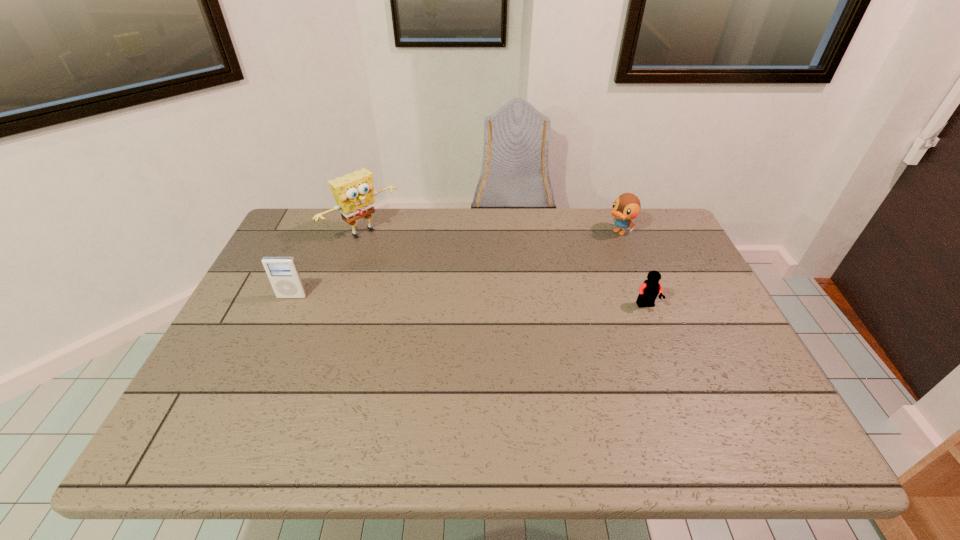
Find the location of a particular element. blank space located on the front-facing side of the duck is located at coordinates (591, 252).

Identify the location of vacant space located 0.130m on the front-facing side of the duck. Image resolution: width=960 pixels, height=540 pixels. (585, 256).

Image resolution: width=960 pixels, height=540 pixels. What are the coordinates of `free point located on the front-facing side of the duck` in the screenshot? It's located at (574, 264).

Find the location of `sponge situated at the far edge`. sponge situated at the far edge is located at coordinates (354, 193).

The width and height of the screenshot is (960, 540). I want to click on duck that is at the far edge, so click(x=626, y=207).

Identify the location of iPod present at the left edge. (282, 272).

Find the location of a particular element. The width and height of the screenshot is (960, 540). sponge at the left edge is located at coordinates (354, 193).

Locate an element on the screen. Lego that is at the right edge is located at coordinates (648, 291).

Find the location of a particular element. This screenshot has width=960, height=540. duck present at the right edge is located at coordinates click(626, 207).

This screenshot has width=960, height=540. Identify the location of object situated at the far left corner. (354, 193).